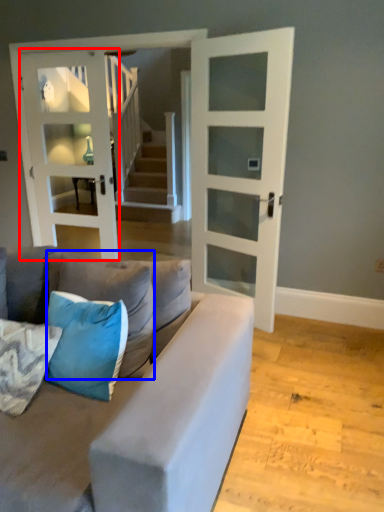
Question: Which object is closer to the camera taking this photo, door (highlighted by a red box) or pillow (highlighted by a blue box)?

Choices:
 (A) door
 (B) pillow

Answer: (B)